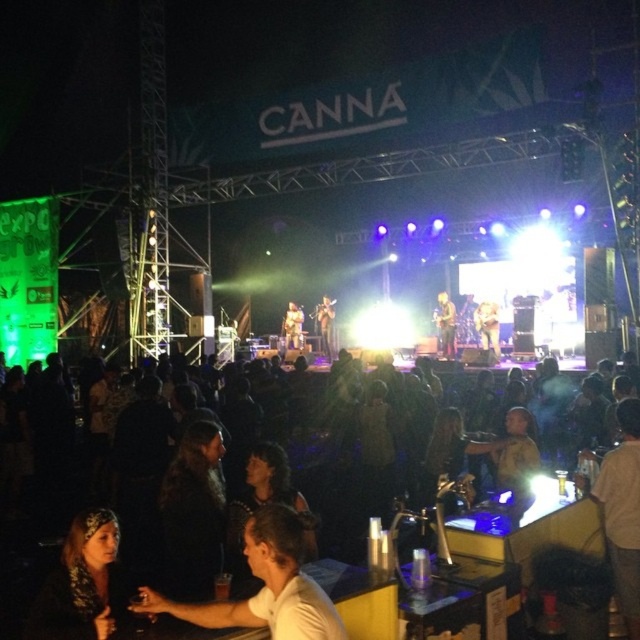
Question: Is shiny gold guitar at center thinner than matte wood guitar at center?

Choices:
 (A) no
 (B) yes

Answer: (B)

Question: Is white cotton shirt at lower right bigger than matte wood guitar at center?

Choices:
 (A) yes
 (B) no

Answer: (B)

Question: Which object is the farthest from the white cotton shirt at lower right?

Choices:
 (A) shiny gold guitar at center
 (B) dark brown leather jacket at lower left
 (C) matte black microphone at center

Answer: (C)

Question: Estimate the real-world distances between objects in this image. Which object is closer to the white matte shirt at lower center?

Choices:
 (A) smooth wooden guitar at center
 (B) shiny gold guitar at center

Answer: (A)

Question: Can you confirm if white cotton shirt at lower right is positioned to the right of shiny gold guitar at center?

Choices:
 (A) yes
 (B) no

Answer: (B)

Question: Which of these objects is positioned farthest from the shiny gold guitar at center?

Choices:
 (A) dark brown leather jacket at lower left
 (B) smooth wooden guitar at center
 (C) matte wood guitar at center

Answer: (A)